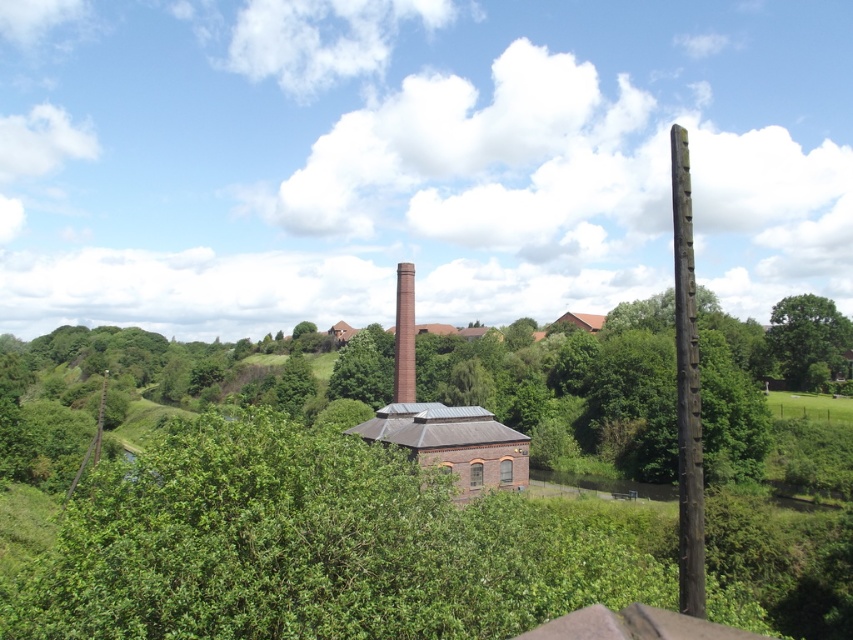
Does point (685, 586) come farther from viewer compared to point (402, 349)?

No, it is in front of (402, 349).

Between point (692, 330) and point (404, 282), which one is positioned behind?

Positioned behind is point (404, 282).

At what (x,y) coordinates should I click in order to perform the action: click on brown wooden pole at right. Please return your answer as a coordinate pair (x, y). The height and width of the screenshot is (640, 853). Looking at the image, I should click on (686, 388).

Based on the photo, which of these two, brown wooden pole at right or green leafy tree at right, stands shorter?

green leafy tree at right

Is point (679, 541) farther from camera compared to point (793, 355)?

No.

In order to click on brown wooden pole at right in this screenshot , I will do `click(686, 388)`.

Locate an element on the screen. The width and height of the screenshot is (853, 640). brown wooden pole at right is located at coordinates (686, 388).

Between green leafy tree at right and red brick chimney at center, which one is positioned higher?

red brick chimney at center

Who is shorter, green leafy tree at right or red brick chimney at center?

green leafy tree at right is shorter.

Does point (799, 310) lie behind point (403, 333)?

Yes, point (799, 310) is farther from viewer.

Where is `green leafy tree at right`? green leafy tree at right is located at coordinates (807, 339).